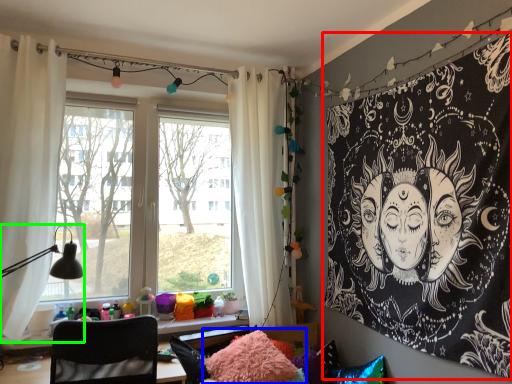
Question: Which is nearer to the bulletin board (highlighted by a red box)? pillow (highlighted by a blue box) or table lamp (highlighted by a green box).

Choices:
 (A) pillow
 (B) table lamp

Answer: (A)